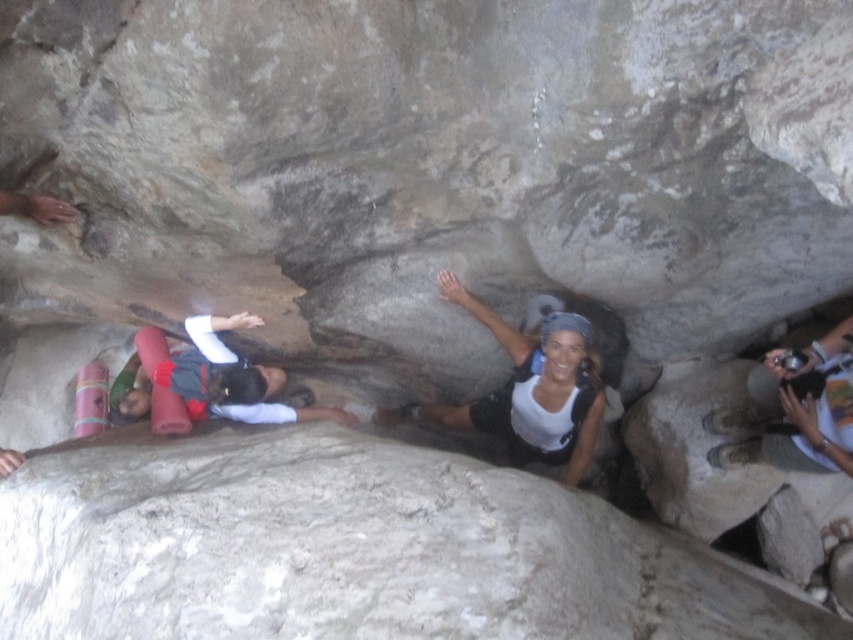
Question: Where is white matte tank top at center located in relation to white fabric camera at right in the image?

Choices:
 (A) left
 (B) right

Answer: (A)

Question: Does white matte tank top at center have a greater width compared to white fabric camera at right?

Choices:
 (A) yes
 (B) no

Answer: (A)

Question: Which of the following is the closest to the observer?

Choices:
 (A) [x=567, y=336]
 (B) [x=820, y=461]

Answer: (B)

Question: Is white matte tank top at center to the left of white fabric camera at right from the viewer's perspective?

Choices:
 (A) yes
 (B) no

Answer: (A)

Question: Which point is farther from the camera taking this photo?

Choices:
 (A) (828, 380)
 (B) (398, 417)

Answer: (B)